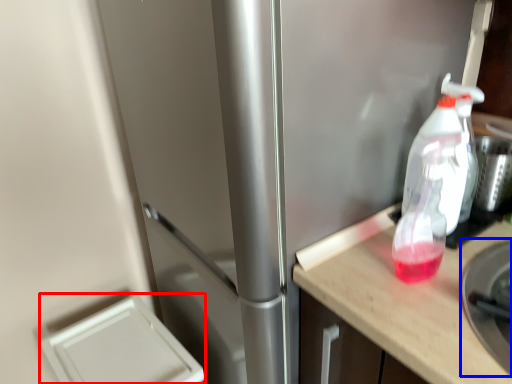
Question: Among these objects, which one is farthest to the camera, appliance (highlighted by a red box) or appliance (highlighted by a blue box)?

Choices:
 (A) appliance
 (B) appliance

Answer: (A)